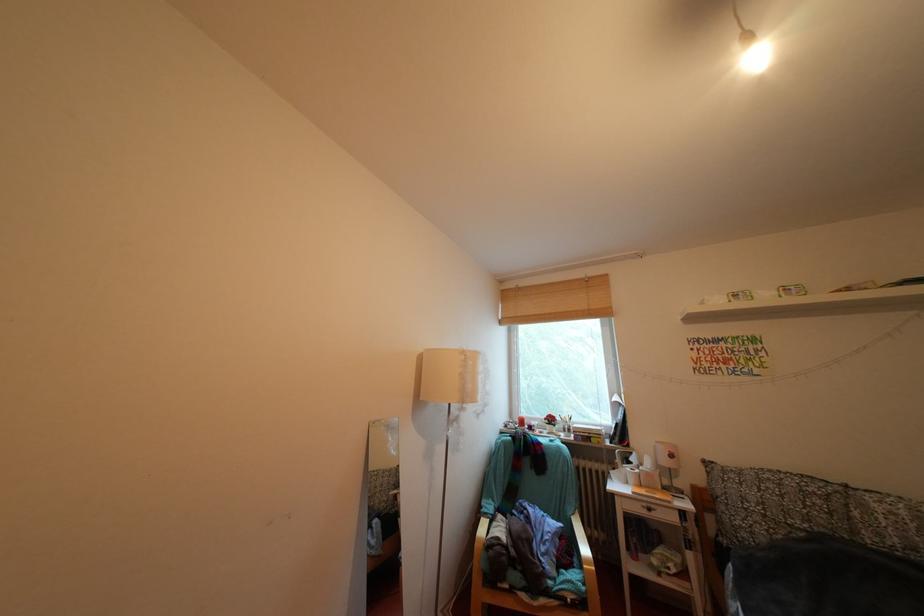
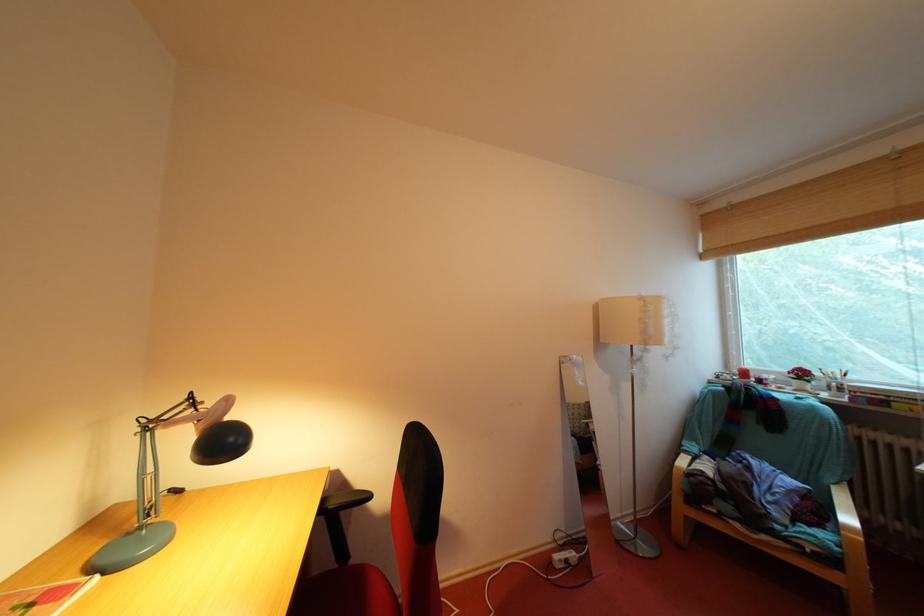
The point at [568,424] is marked in the first image. Where is the corresponding point in the second image?

(829, 379)